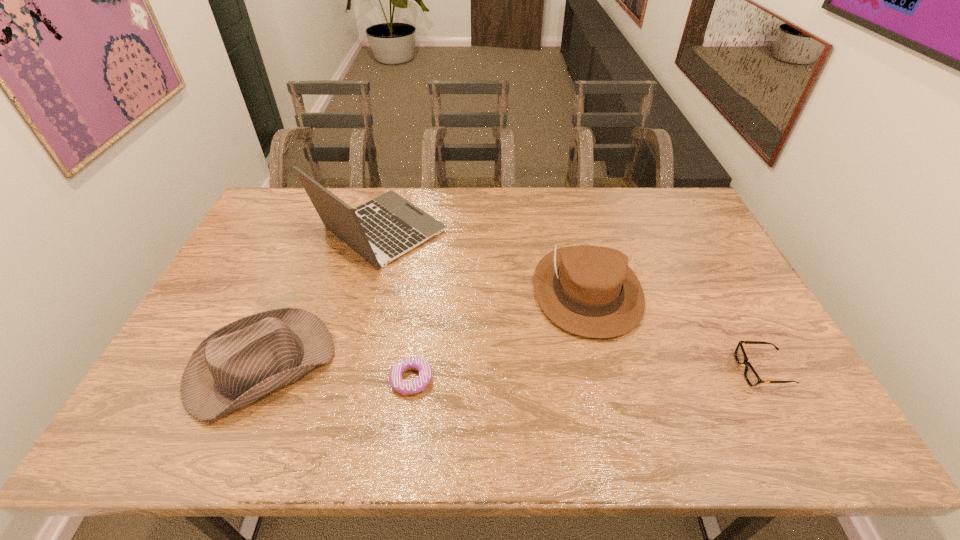
What are the coordinates of `laptop_computer` in the screenshot? It's located at (389, 226).

Identify the location of the right fedora. (590, 291).

The width and height of the screenshot is (960, 540). I want to click on the taller fedora, so click(590, 291).

The height and width of the screenshot is (540, 960). Find the location of `the third tallest object`. the third tallest object is located at coordinates (239, 363).

This screenshot has height=540, width=960. Identify the location of the left fedora. [239, 363].

The width and height of the screenshot is (960, 540). In order to click on sunglasses in this screenshot , I will do `click(751, 376)`.

The height and width of the screenshot is (540, 960). Find the location of `doughnut`. doughnut is located at coordinates (405, 387).

You are a GUI agent. You are given a task and a screenshot of the screen. Output one action in this format:
    pyautogui.click(x=<x>, y=<y>)
    Task: Click on the vacant area located 0.140m at the front screen of the laptop_computer
    
    Given the screenshot: What is the action you would take?
    pyautogui.click(x=489, y=231)

Locate an element on the screen. vacant space located 0.220m on the feather side of the fourth object from left to right is located at coordinates (618, 418).

Find the location of `vacant area situated 0.340m on the right of the third shortest object`. vacant area situated 0.340m on the right of the third shortest object is located at coordinates [x=468, y=366].